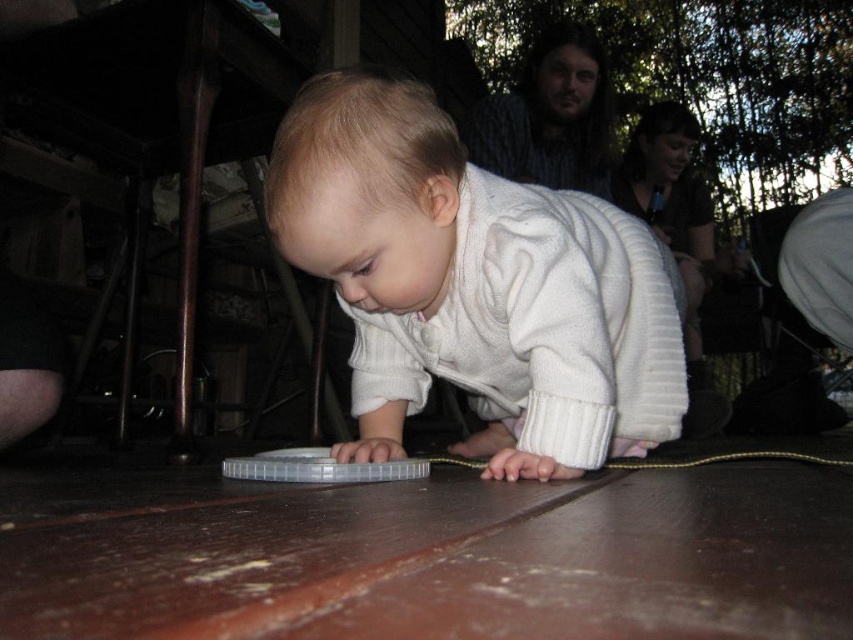
Based on the photo, you are a parent looking for your baby in a crowded park. You remember your baby is wearing a white ribbed sweater at center. Based on the image description, where should you look to find the baby?

The white ribbed sweater at center is located at point (x=474, y=285), so you should look towards the center of the image near those coordinates to find the baby.

You are a parent trying to retrieve an item for your baby. You see the white ribbed sweater at center and the clear plastic lid at center. Which item is closer to the baby?

The white ribbed sweater at center is located above the clear plastic lid at center, so the clear plastic lid at center is closer to the baby.